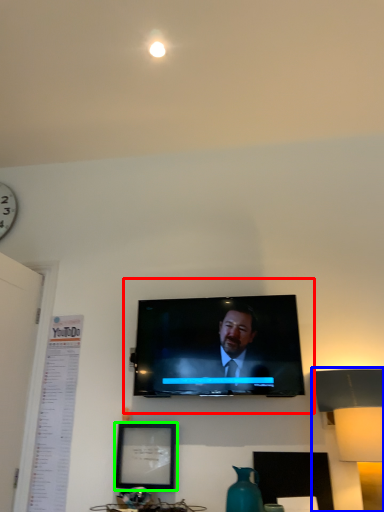
Question: Which is farther away from tv show (highlighted by a red box)? table lamp (highlighted by a blue box) or picture frame (highlighted by a green box)?

Choices:
 (A) table lamp
 (B) picture frame

Answer: (A)